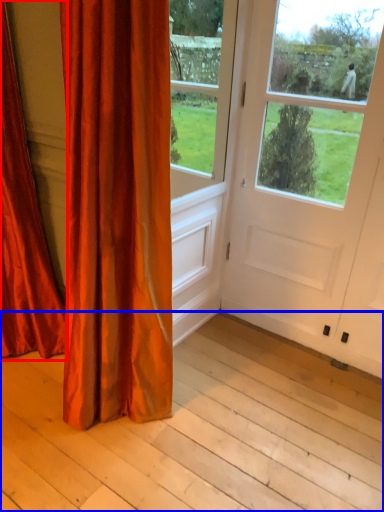
Question: Which point is closer to the camera, curtain (highlighted by a red box) or plank (highlighted by a blue box)?

Choices:
 (A) curtain
 (B) plank

Answer: (B)